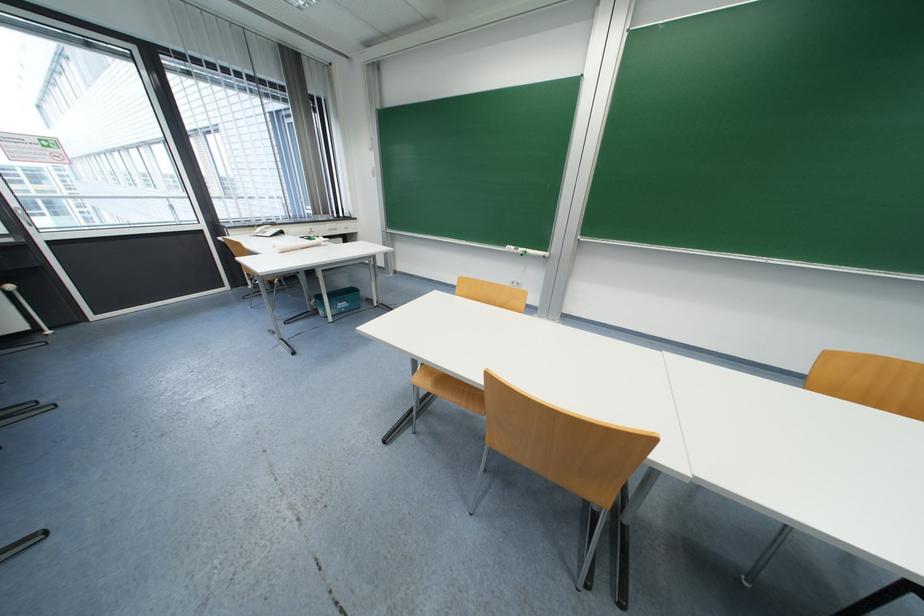
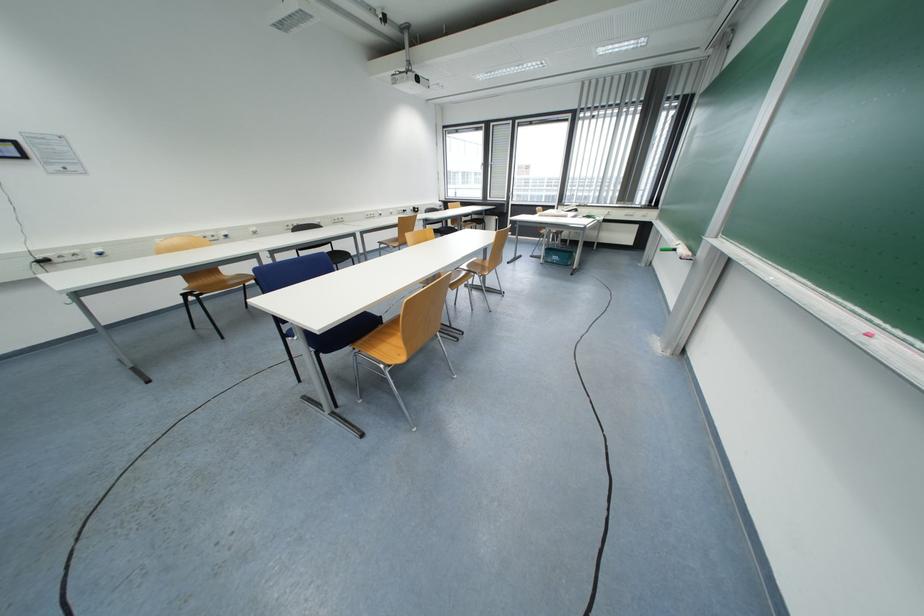
In the second image, find the point that corresponds to pixel 517 249 in the first image.

(683, 244)